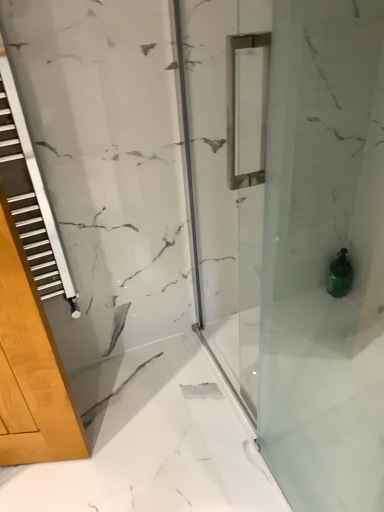
Measure the distance between point (331, 313) and camera.

Point (331, 313) and camera are 1.85 meters apart from each other.

Where is `transparent glass shower door at center`? The width and height of the screenshot is (384, 512). transparent glass shower door at center is located at coordinates (324, 256).

What do you see at coordinates (324, 256) in the screenshot? I see `transparent glass shower door at center` at bounding box center [324, 256].

What do you see at coordinates (340, 275) in the screenshot? This screenshot has height=512, width=384. I see `green glass bottle at lower right` at bounding box center [340, 275].

Where is `green glass bottle at lower right`? The image size is (384, 512). green glass bottle at lower right is located at coordinates coord(340,275).

Identify the location of transparent glass shower door at center. Image resolution: width=384 pixels, height=512 pixels. (324, 256).

Can you confirm if transparent glass shower door at center is positioned to the right of green glass bottle at lower right?

No.

Which object is further away from the camera taking this photo, transparent glass shower door at center or green glass bottle at lower right?

green glass bottle at lower right is further away from the camera.

Is point (308, 241) more distant than point (337, 291)?

That is False.

From the image's perspective, relative to green glass bottle at lower right, is transparent glass shower door at center above or below?

transparent glass shower door at center is situated higher than green glass bottle at lower right in the image.

From a real-world perspective, which is physically above, transparent glass shower door at center or green glass bottle at lower right?

In real-world perspective, transparent glass shower door at center is above.

Considering the sizes of objects transparent glass shower door at center and green glass bottle at lower right in the image provided, who is wider, transparent glass shower door at center or green glass bottle at lower right?

Wider between the two is green glass bottle at lower right.

Does transparent glass shower door at center have a lesser height compared to green glass bottle at lower right?

No, transparent glass shower door at center is not shorter than green glass bottle at lower right.

Is transparent glass shower door at center bigger or smaller than green glass bottle at lower right?

Clearly, transparent glass shower door at center is larger in size than green glass bottle at lower right.

Is green glass bottle at lower right located within transparent glass shower door at center?

No, green glass bottle at lower right is not inside transparent glass shower door at center.

Is transparent glass shower door at center not near green glass bottle at lower right?

No, transparent glass shower door at center is in close proximity to green glass bottle at lower right.

Could you tell me if transparent glass shower door at center is facing green glass bottle at lower right?

No, transparent glass shower door at center is not turned towards green glass bottle at lower right.

How many degrees apart are the facing directions of transparent glass shower door at center and green glass bottle at lower right?

The angular difference between transparent glass shower door at center and green glass bottle at lower right is 0.013 degrees.

You are a GUI agent. You are given a task and a screenshot of the screen. Output one action in this format:
    pyautogui.click(x=<x>, y=<y>)
    Task: Click on the bottle located on the right of transparent glass shower door at center
    Image resolution: width=384 pixels, height=512 pixels.
    Given the screenshot: What is the action you would take?
    340,275

Can you confirm if green glass bottle at lower right is positioned to the left of transparent glass shower door at center?

No, green glass bottle at lower right is not to the left of transparent glass shower door at center.

Which object is more forward, green glass bottle at lower right or transparent glass shower door at center?

transparent glass shower door at center is more forward.

Which is behind, point (327, 280) or point (292, 304)?

Positioned behind is point (327, 280).

From the image's perspective, does green glass bottle at lower right appear lower than transparent glass shower door at center?

Indeed, from the image's perspective, green glass bottle at lower right is shown beneath transparent glass shower door at center.

From a real-world perspective, is green glass bottle at lower right located beneath transparent glass shower door at center?

Indeed, from a real-world perspective, green glass bottle at lower right is positioned beneath transparent glass shower door at center.

Can you confirm if green glass bottle at lower right is wider than transparent glass shower door at center?

Indeed, green glass bottle at lower right has a greater width compared to transparent glass shower door at center.

From their relative heights in the image, would you say green glass bottle at lower right is taller or shorter than transparent glass shower door at center?

In the image, green glass bottle at lower right appears to be shorter than transparent glass shower door at center.

Considering the sizes of objects green glass bottle at lower right and transparent glass shower door at center in the image provided, who is smaller, green glass bottle at lower right or transparent glass shower door at center?

With smaller size is green glass bottle at lower right.

Is green glass bottle at lower right surrounding transparent glass shower door at center?

No, transparent glass shower door at center is not a part of green glass bottle at lower right.

Is green glass bottle at lower right directly adjacent to transparent glass shower door at center?

No, green glass bottle at lower right is not beside transparent glass shower door at center.

Is green glass bottle at lower right aimed at transparent glass shower door at center?

Yes, green glass bottle at lower right faces towards transparent glass shower door at center.

Looking at this image, can you tell me how much green glass bottle at lower right and transparent glass shower door at center differ in facing direction?

The facing directions of green glass bottle at lower right and transparent glass shower door at center are 0.013 degrees apart.

Measure the distance from green glass bottle at lower right to transparent glass shower door at center.

They are 38.07 centimeters apart.

Identify the location of bottle below the transparent glass shower door at center (from the image's perspective). (340, 275).

Identify the location of shower door on the left of the green glass bottle at lower right. (324, 256).

Locate an element on the screen. The height and width of the screenshot is (512, 384). shower door located above the green glass bottle at lower right (from the image's perspective) is located at coordinates (324, 256).